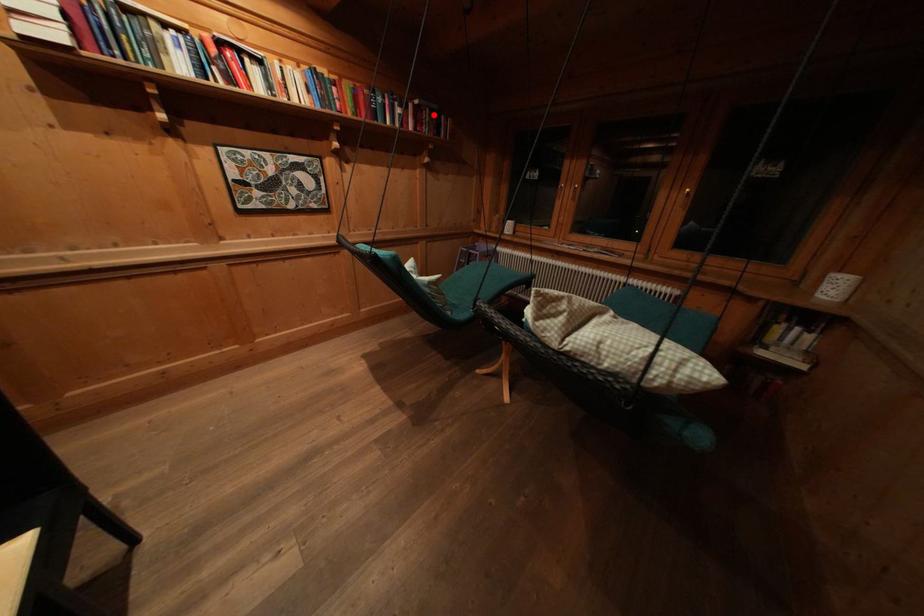
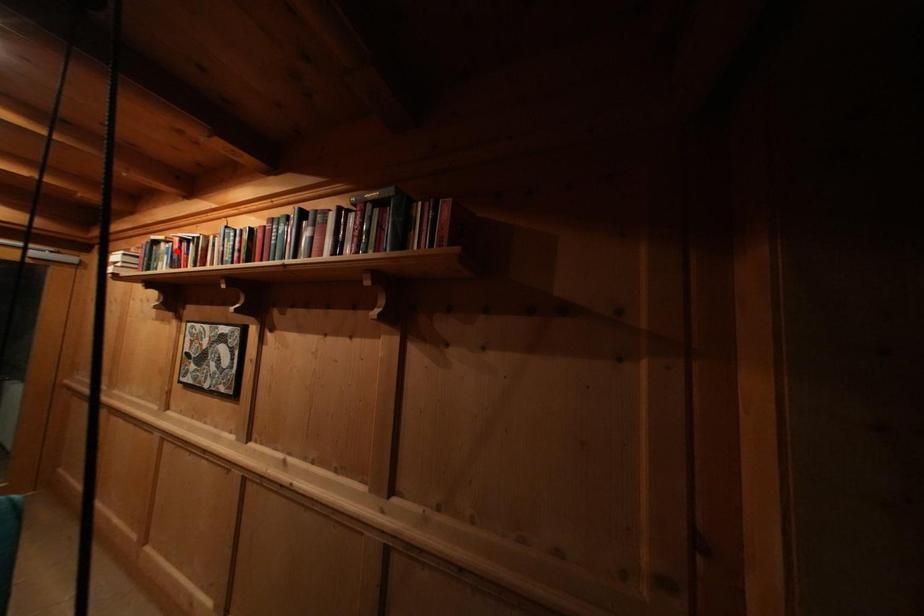
I am providing you with two images of the same scene from different viewpoints. A red point is marked on the first image and another point is marked on the second image. Are the points marked in image1 and image2 representing the same 3D position?

No